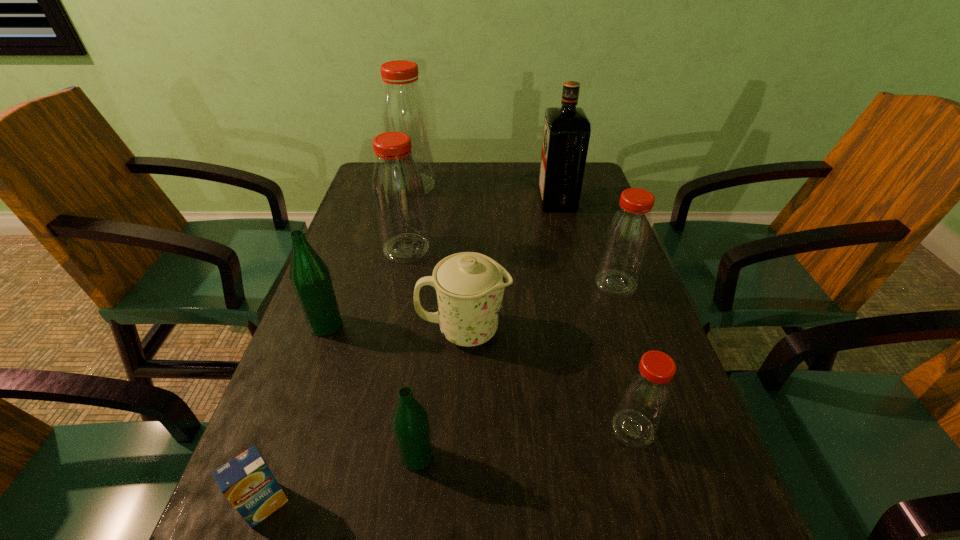
Image resolution: width=960 pixels, height=540 pixels. I want to click on free region located on the front of the second smallest red bottle, so click(678, 464).

Where is `free region located on the back of the fourth farthest bottle`? This screenshot has width=960, height=540. free region located on the back of the fourth farthest bottle is located at coordinates (347, 266).

At what (x,y) coordinates should I click in order to perform the action: click on vacant space located 0.180m on the spout of the chinaware. Please return your answer as a coordinate pair (x, y). Looking at the image, I should click on (595, 330).

The width and height of the screenshot is (960, 540). In order to click on free spot located 0.290m on the back of the nearest red bottle in this screenshot , I will do `click(595, 298)`.

Find the location of `vacant space positioned 0.050m on the left of the smaller green bottle`. vacant space positioned 0.050m on the left of the smaller green bottle is located at coordinates (370, 457).

The image size is (960, 540). Identify the location of vacant space positioned on the back of the shortest object. (302, 400).

Find the location of `bottle that is positioned at the far edge`. bottle that is positioned at the far edge is located at coordinates (403, 108).

I want to click on liquor situated at the far edge, so click(566, 133).

The image size is (960, 540). I want to click on orange_juice at the left edge, so point(246,481).

The width and height of the screenshot is (960, 540). I want to click on liquor that is at the right edge, so click(x=566, y=133).